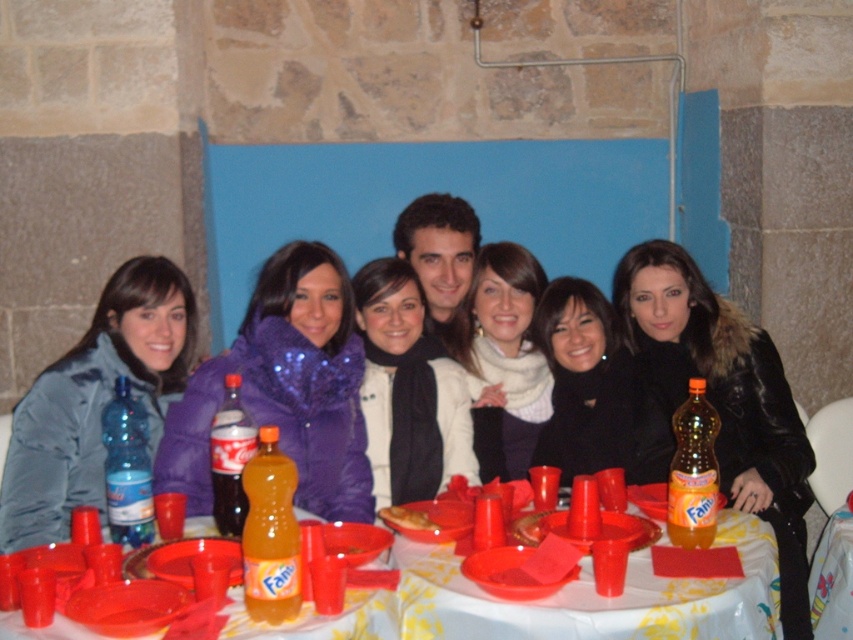
Question: Is matte purple scarf at center wider than orange plastic bottle at center?

Choices:
 (A) no
 (B) yes

Answer: (B)

Question: Which point appears closest to the camera in this image?

Choices:
 (A) [141, 288]
 (B) [419, 529]

Answer: (B)

Question: Is the position of purple sequined jacket at center more distant than that of matte blue jacket at left?

Choices:
 (A) no
 (B) yes

Answer: (A)

Question: Among these points, which one is nearest to the camera?

Choices:
 (A) (706, 404)
 (B) (282, 611)
 (C) (221, 404)
 (D) (392, 515)

Answer: (B)

Question: Is matte blue jacket at left further to the viewer compared to black matte jacket at center?

Choices:
 (A) no
 (B) yes

Answer: (A)

Question: Which object appears closest to the camera in this image?

Choices:
 (A) black leather jacket at center
 (B) matte blue jacket at left
 (C) blue plastic bottle at lower left
 (D) black matte jacket at center

Answer: (C)